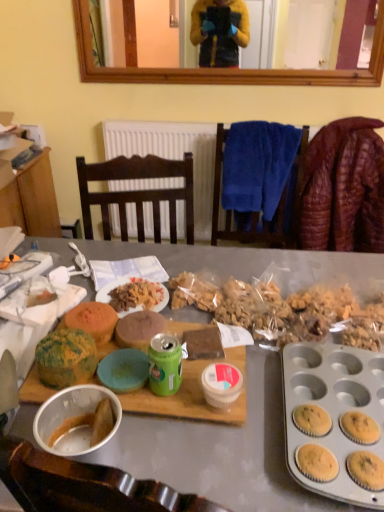
Question: From their relative heights in the image, would you say leather jacket at right is taller or shorter than green matte can at center?

Choices:
 (A) short
 (B) tall

Answer: (B)

Question: From the image's perspective, is leather jacket at right above or below green matte can at center?

Choices:
 (A) above
 (B) below

Answer: (A)

Question: Based on their relative distances, which object is nearer to the matte gray desk at center?

Choices:
 (A) matte plastic plate at center
 (B) leather jacket at right
 (C) green matte can at center
 (D) speckled yellow muffin at center-left, which is the 1th snack from front to back
 (E) green matte muffin at center-left, the 2th snack in the front-to-back sequence

Answer: (A)

Question: Estimate the real-world distances between objects in this image. Which object is closer to the matte gray desk at center?

Choices:
 (A) green matte can at center
 (B) matte plastic plate at center
 (C) speckled yellow muffin at center-left, which appears as the second snack when viewed from the back
 (D) leather jacket at right
 (E) blue soft towel at upper center

Answer: (B)